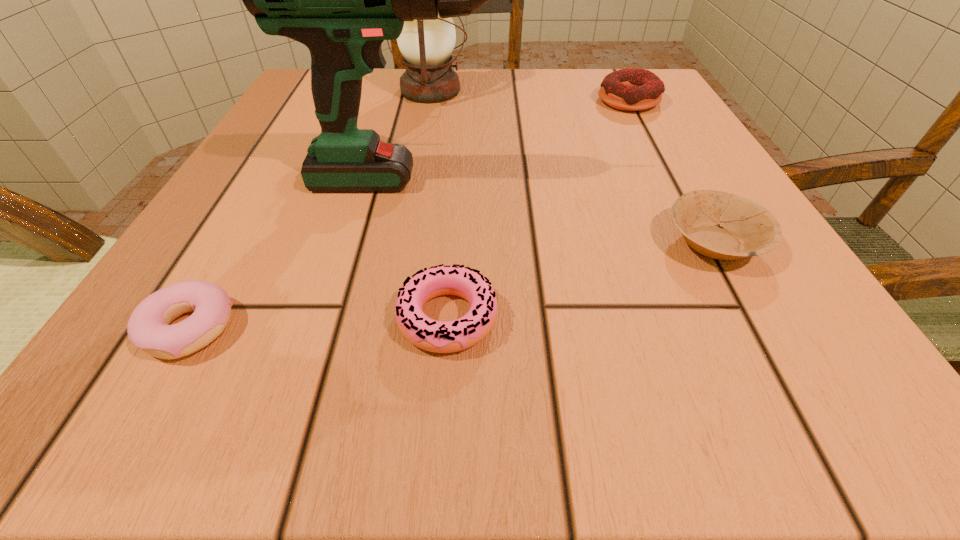
This screenshot has height=540, width=960. I want to click on vacant space situated 0.230m on the left of the bowl, so click(x=486, y=242).

The height and width of the screenshot is (540, 960). Find the location of `vacant area situated on the back of the second doughnut from left to right`. vacant area situated on the back of the second doughnut from left to right is located at coordinates (459, 140).

Locate an element on the screen. Image resolution: width=960 pixels, height=540 pixels. vacant space located on the back of the leftmost object is located at coordinates (305, 127).

Find the location of a particular element. This screenshot has width=960, height=540. oil lamp present at the far edge is located at coordinates (426, 45).

The height and width of the screenshot is (540, 960). I want to click on doughnut that is at the far edge, so click(x=629, y=89).

At what (x,y) coordinates should I click in order to perform the action: click on drill at the left edge. Please return your answer as a coordinate pair (x, y). This screenshot has width=960, height=540. Looking at the image, I should click on (341, 0).

Locate an element on the screen. The image size is (960, 540). doughnut present at the left edge is located at coordinates (148, 328).

Locate an element on the screen. The width and height of the screenshot is (960, 540). doughnut at the right edge is located at coordinates (629, 89).

Image resolution: width=960 pixels, height=540 pixels. What are the coordinates of `bowl present at the right edge` in the screenshot? It's located at tap(746, 228).

This screenshot has width=960, height=540. What are the coordinates of `object present at the near left corner` in the screenshot? It's located at (148, 328).